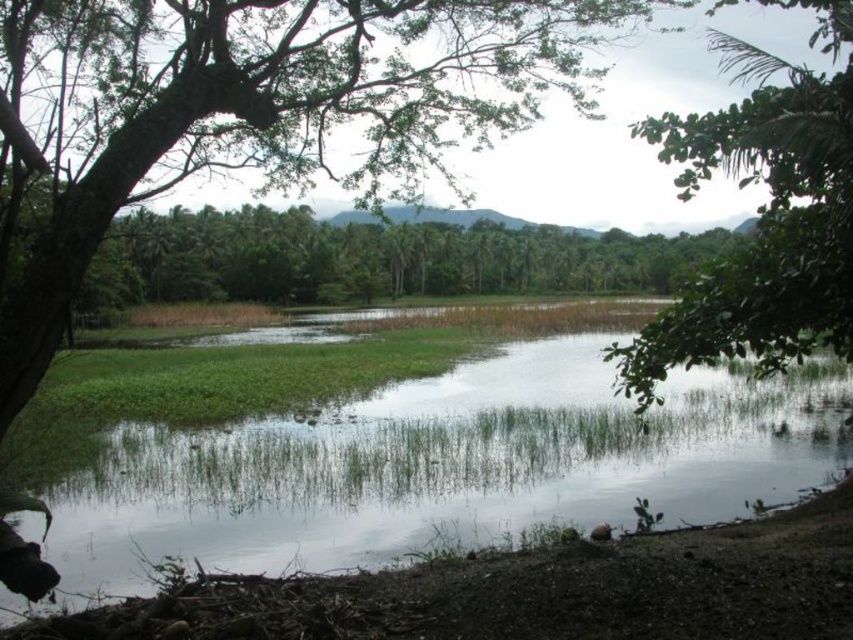
Who is positioned more to the right, green grassy creek at center or green leafy tree at upper left?

From the viewer's perspective, green leafy tree at upper left appears more on the right side.

Is green grassy creek at center above green leafy tree at upper left?

Actually, green grassy creek at center is below green leafy tree at upper left.

Measure the distance between green grassy creek at center and camera.

green grassy creek at center is 6.65 meters away from camera.

In order to click on green grassy creek at center in this screenshot , I will do `click(445, 467)`.

Is green grassy creek at center above green leafy tree at right?

No, green grassy creek at center is not above green leafy tree at right.

Is point (386, 464) positioned in front of point (828, 138)?

No, it is behind (828, 138).

Is point (125, 582) positioned after point (740, 275)?

Yes, it is.

Where is `green grassy creek at center`? Image resolution: width=853 pixels, height=640 pixels. green grassy creek at center is located at coordinates (445, 467).

Can you confirm if green leafy tree at upper left is wider than green leafy tree at right?

In fact, green leafy tree at upper left might be narrower than green leafy tree at right.

Is green leafy tree at upper left positioned behind green leafy tree at right?

That is False.

Between point (1, 273) and point (627, 364), which one is positioned in front?

Point (1, 273)

The image size is (853, 640). I want to click on green leafy tree at upper left, so click(252, 109).